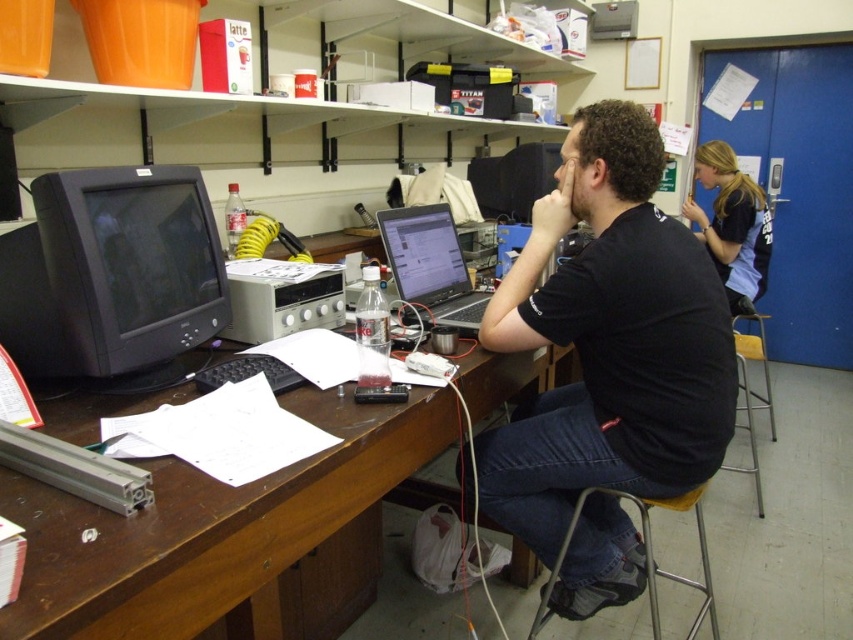
Question: Does black cotton shirt at center appear under black t-shirt at upper right?

Choices:
 (A) no
 (B) yes

Answer: (B)

Question: Which of the following is the farthest from the observer?

Choices:
 (A) matte black monitor at left
 (B) black t-shirt at upper right

Answer: (B)

Question: Considering the relative positions of black cotton shirt at center and silver metallic laptop at center in the image provided, where is black cotton shirt at center located with respect to silver metallic laptop at center?

Choices:
 (A) left
 (B) right

Answer: (B)

Question: Does brown wood computer desk at center appear over metallic silver stool at lower center?

Choices:
 (A) yes
 (B) no

Answer: (A)

Question: Which point is closer to the camera?

Choices:
 (A) (199, 282)
 (B) (297, 392)

Answer: (B)

Question: Which point appears closest to the camera in this image?

Choices:
 (A) (422, 264)
 (B) (416, 452)
 (C) (556, 568)
 (D) (160, 362)

Answer: (B)